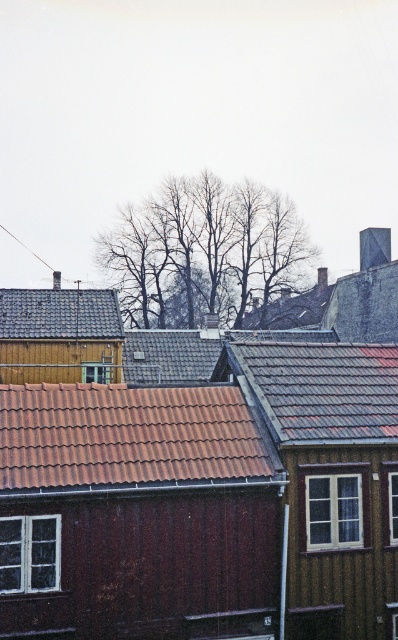
You are a drone operator tasked with capturing aerial footage of the rooftops. The drone has a camera with a fixed width field of view. If you want to ensure both the brown tile roof at center and the gray tile roof at center are fully visible in the same frame, which roof should you position closer to the center of the camera view?

The brown tile roof at center is wider than the gray tile roof at center. To ensure both are fully visible, position the brown tile roof at center closer to the center of the camera view since its greater width requires more space in the frame.

You are a drone operator planning to fly a drone over the rooftops in the image. The drone has a maximum flight altitude of 10 meters. Given that the brown tile roof at center is shorter than the gray slate roof at upper left, can you safely fly the drone between these two roofs without exceeding the altitude limit?

The brown tile roof at center is shorter than the gray slate roof at upper left. Since the drone has a maximum flight altitude of 10 meters, it can safely fly between them as long as the height difference between the two roofs is within the drone s altitude capability.

You are standing 15 meters away from a point labeled as point (x=267, y=406) in this scene. Can you reach that point without moving closer than 15 meters from your current position?

The distance of point (x=267, y=406) from viewer is 22.25 meters, so you are currently 15 meters away and need to move an additional 7.25 meters forward to reach the point. Therefore, you cannot stay at 15 meters and still reach the point without moving closer.